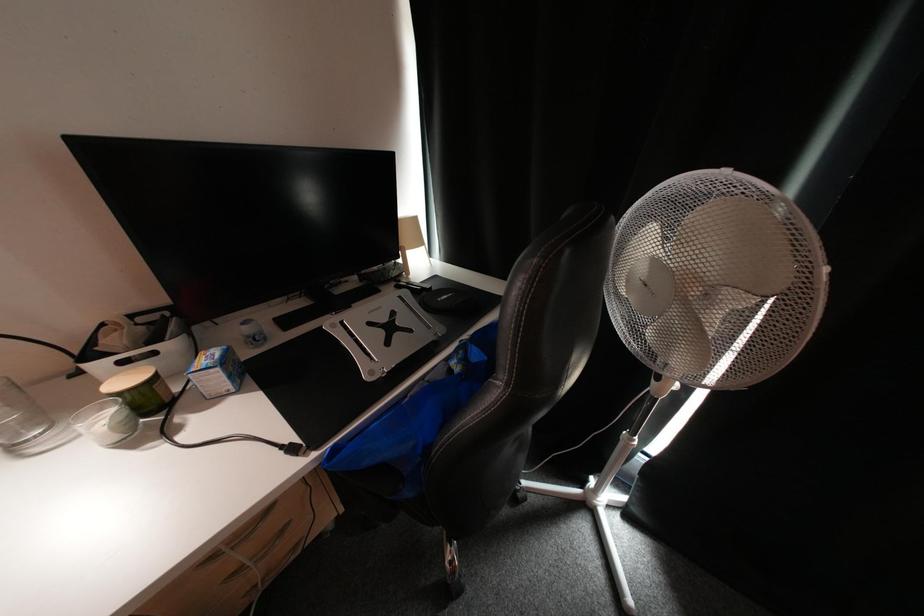
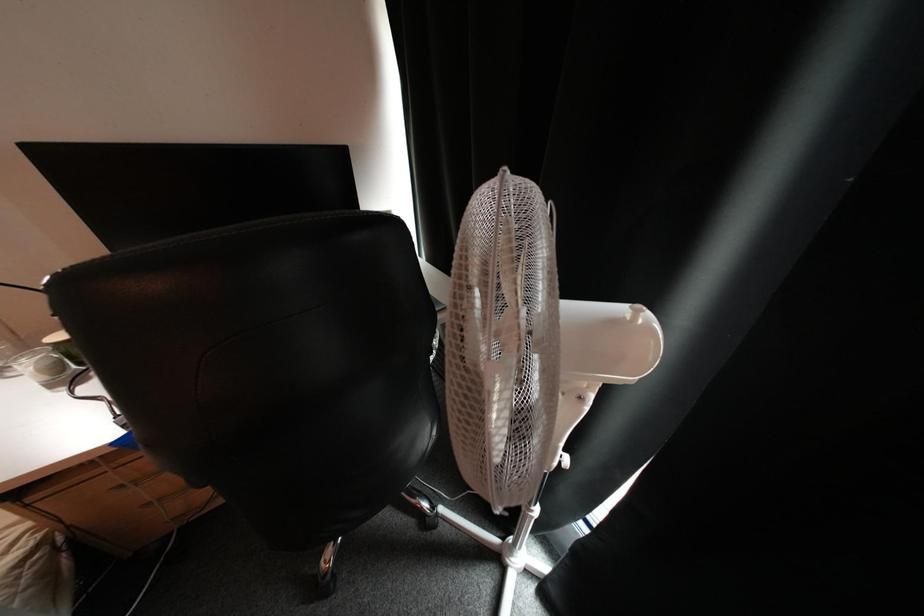
Question: The images are taken continuously from a first-person perspective. In which direction is your viewpoint rotating?

Choices:
 (A) Left
 (B) Right
 (C) Up
 (D) Down

Answer: (A)